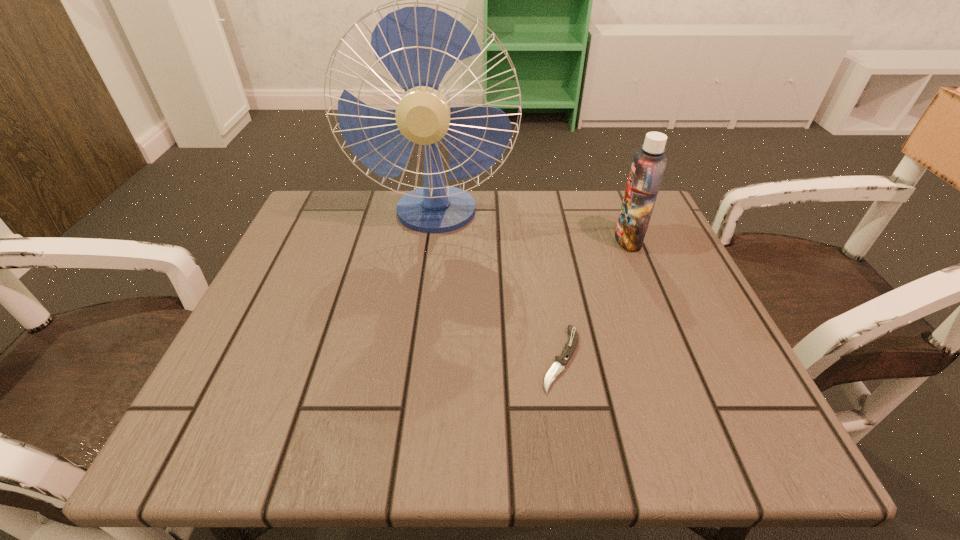
Locate an element on the screen. This screenshot has height=540, width=960. the tallest object is located at coordinates (417, 45).

You are a GUI agent. You are given a task and a screenshot of the screen. Output one action in this format:
    pyautogui.click(x=<x>, y=<y>)
    Task: Click on the fan
    Image resolution: width=960 pixels, height=540 pixels.
    Given the screenshot: What is the action you would take?
    pyautogui.click(x=417, y=45)

Find the location of `shampoo`. shampoo is located at coordinates (648, 166).

I want to click on the rightmost object, so pos(648,166).

This screenshot has width=960, height=540. I want to click on the shortest object, so click(x=561, y=361).

Image resolution: width=960 pixels, height=540 pixels. I want to click on the second object from left to right, so click(561, 361).

What are the coordinates of `free space located at the front of the tallest object where the blades are visible` in the screenshot? It's located at (414, 387).

In order to click on free space located 0.340m on the front label of the second shortest object in this screenshot , I will do `click(464, 239)`.

Locate an element on the screen. This screenshot has height=540, width=960. vacant region located 0.360m on the front label of the second shortest object is located at coordinates (455, 239).

You are a GUI agent. You are given a task and a screenshot of the screen. Output one action in this format:
    pyautogui.click(x=<x>, y=<y>)
    Task: Click on the free spot located 0.360m on the front label of the second shortest object
    This screenshot has height=540, width=960.
    Given the screenshot: What is the action you would take?
    pyautogui.click(x=455, y=239)